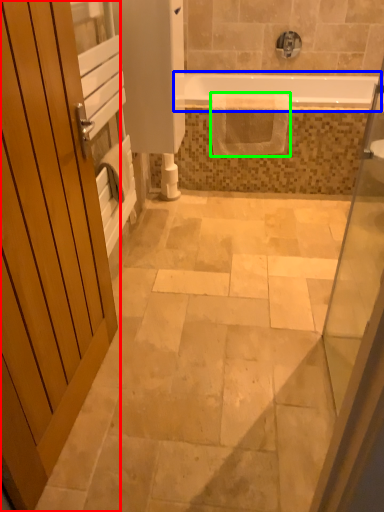
Question: Which object is the farthest from door (highlighted by a red box)? Choose among these: bathtub (highlighted by a blue box) or material (highlighted by a green box).

Choices:
 (A) bathtub
 (B) material

Answer: (A)